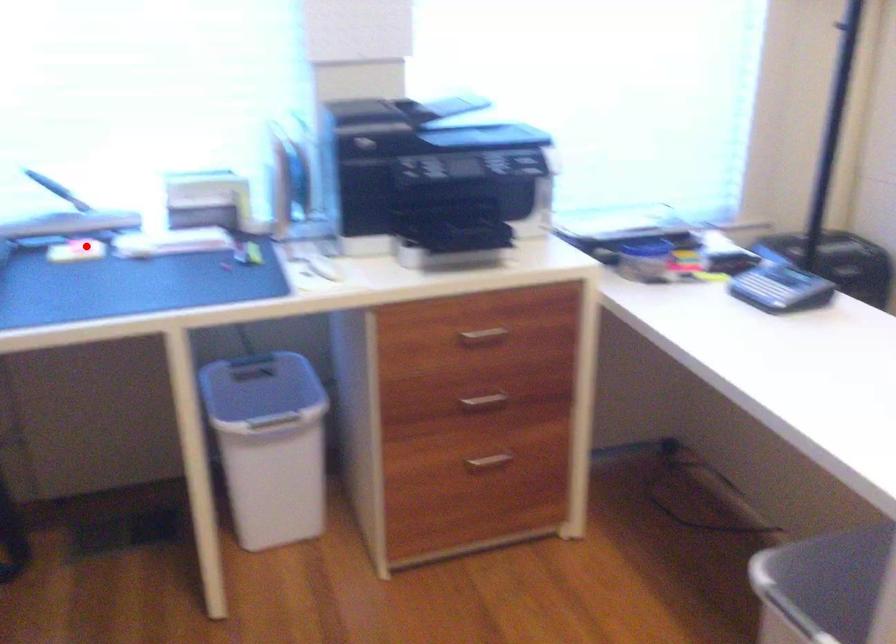
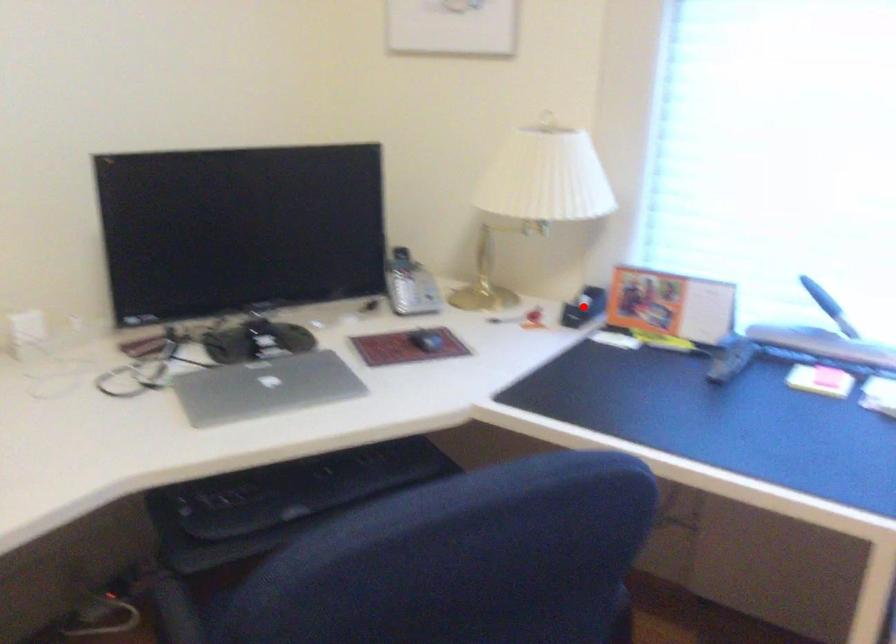
I am providing you with two images of the same scene from different viewpoints. A red point is marked on the first image and another point is marked on the second image. Are the points marked in image1 and image2 representing the same 3D position?

No